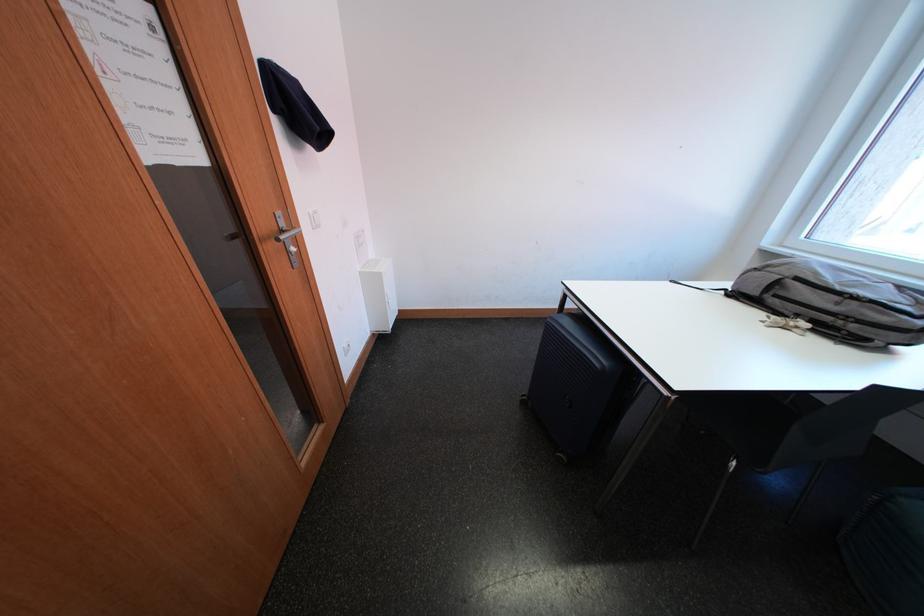
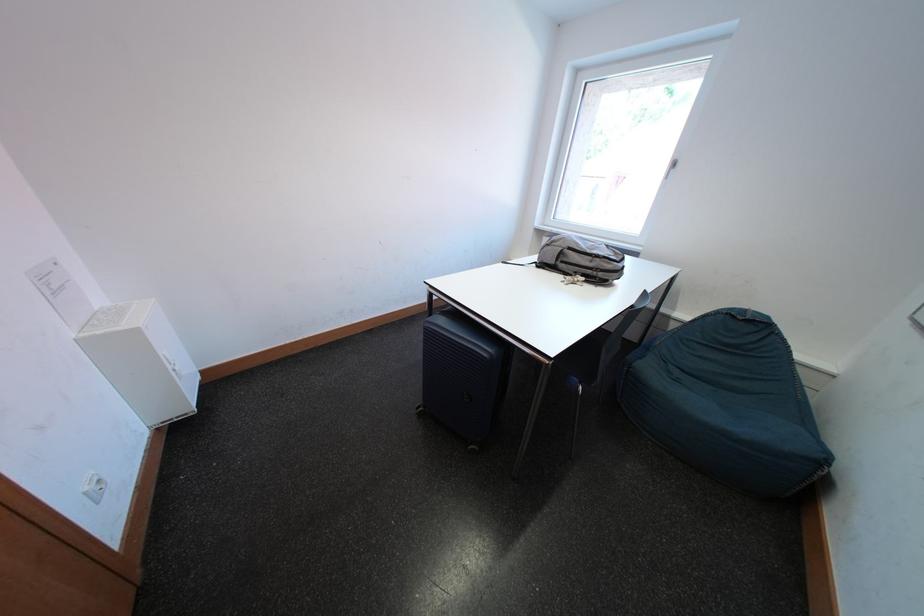
Question: I am providing you with two images of the same scene from different viewpoints. Which of the following objects are not visible in image2?

Choices:
 (A) blue suitcase
 (B) chair sitting surface
 (C) backpack handle
 (D) none of these

Answer: (D)